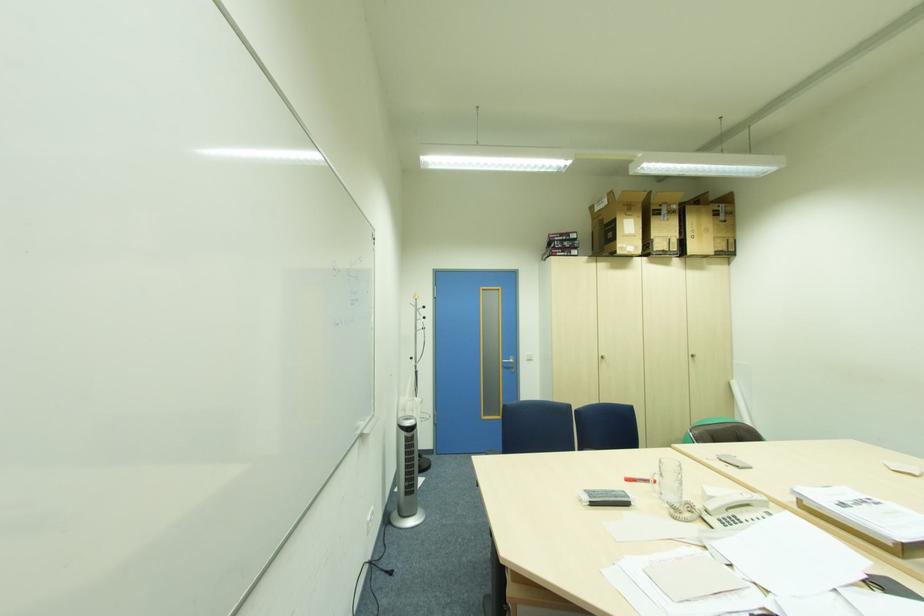
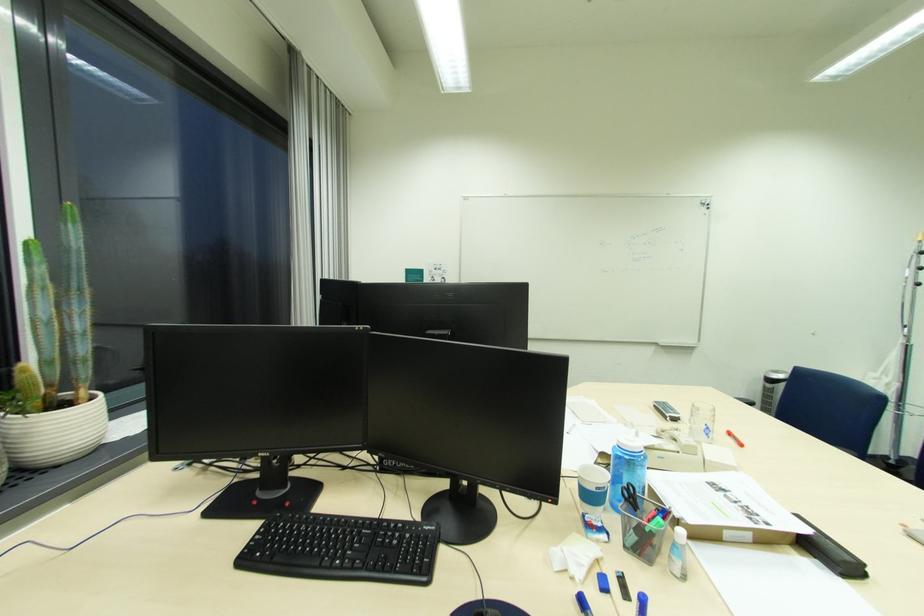
The point at (634, 482) is marked in the first image. Where is the corresponding point in the second image?

(736, 435)